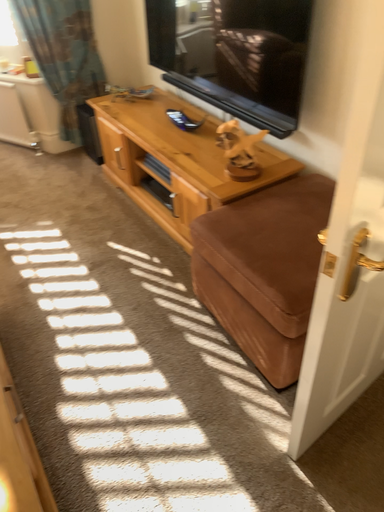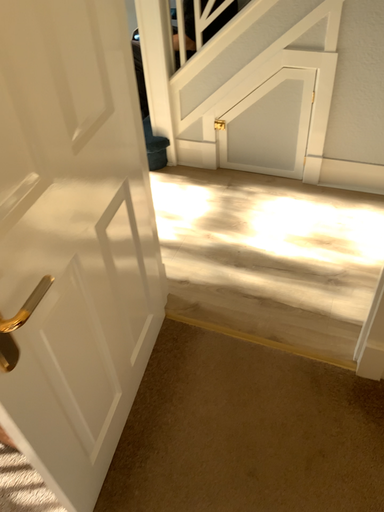
Question: How did the camera likely rotate when shooting the video?

Choices:
 (A) rotated right
 (B) rotated left

Answer: (A)